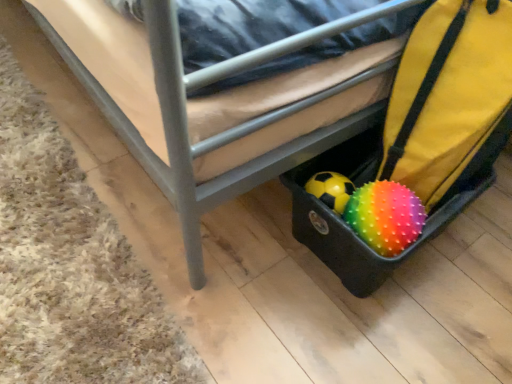
Find the location of a particular element. The width and height of the screenshot is (512, 384). free location above brown carpet at lower left (from a real-world perspective) is located at coordinates (48, 227).